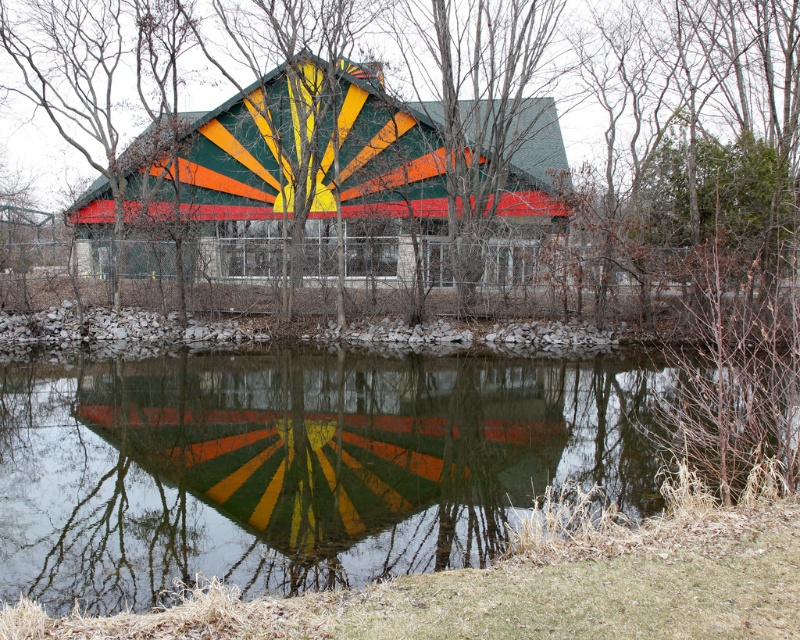
Which is more to the right, transparent water at center or multicolored painted roof at center?

From the viewer's perspective, multicolored painted roof at center appears more on the right side.

Between transparent water at center and multicolored painted roof at center, which one has less height?

transparent water at center is shorter.

Find the location of a particular element. transparent water at center is located at coordinates (297, 465).

What do you see at coordinates (424, 138) in the screenshot?
I see `green matte tree at center` at bounding box center [424, 138].

Does green matte tree at center have a smaller size compared to transparent water at center?

Actually, green matte tree at center might be larger than transparent water at center.

At what (x,y) coordinates should I click in order to perform the action: click on green matte tree at center. Please return your answer as a coordinate pair (x, y). Looking at the image, I should click on (424, 138).

Does multicolored painted roof at center lie in front of painted wooden barn at center?

Yes.

Can you confirm if multicolored painted roof at center is positioned below painted wooden barn at center?

Correct, multicolored painted roof at center is located below painted wooden barn at center.

Who is more forward, (474, 545) or (378, 113)?

Positioned in front is point (474, 545).

Find the location of a particular element. multicolored painted roof at center is located at coordinates (340, 445).